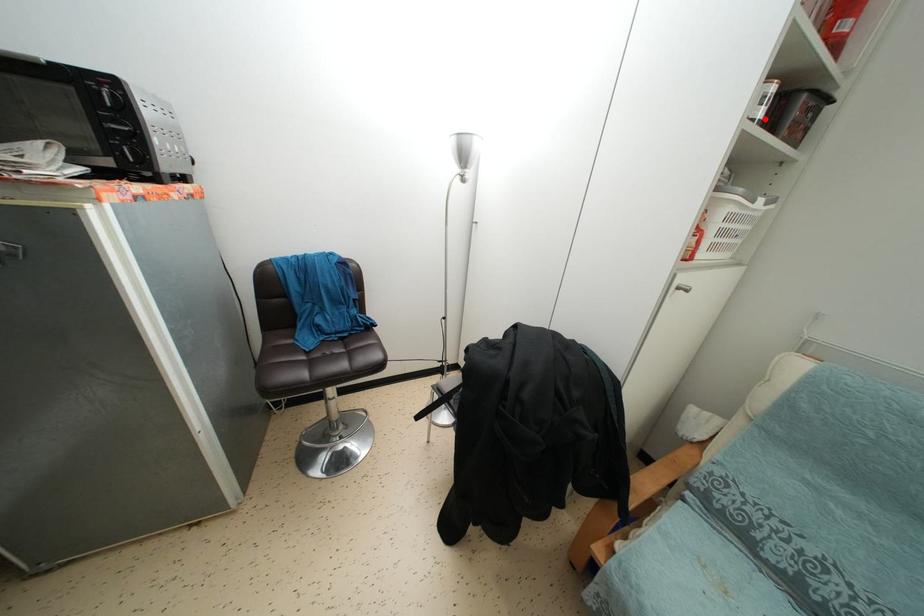
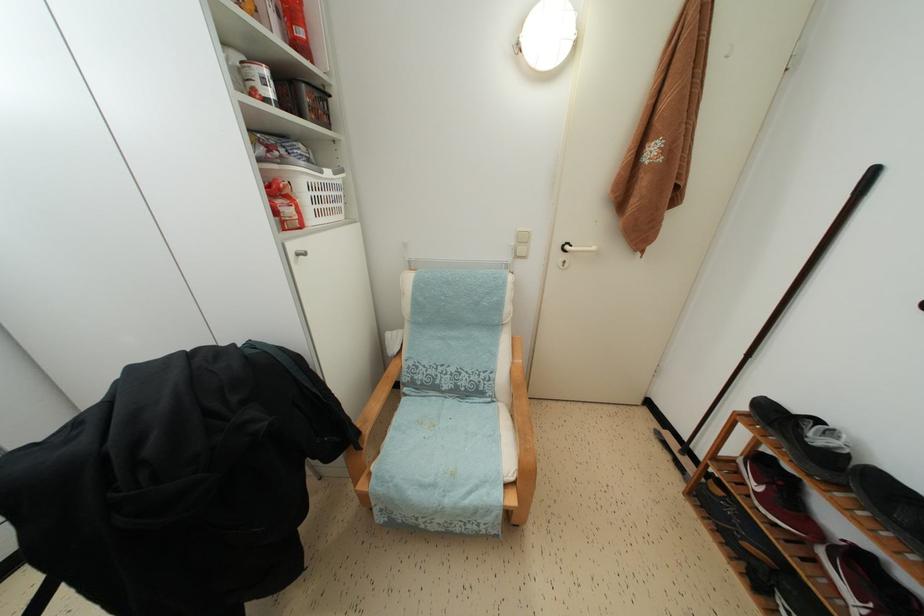
The point at the highlighted location is marked in the first image. Where is the corresponding point in the second image?

(274, 100)